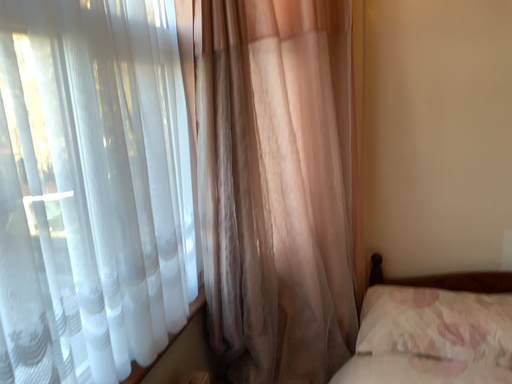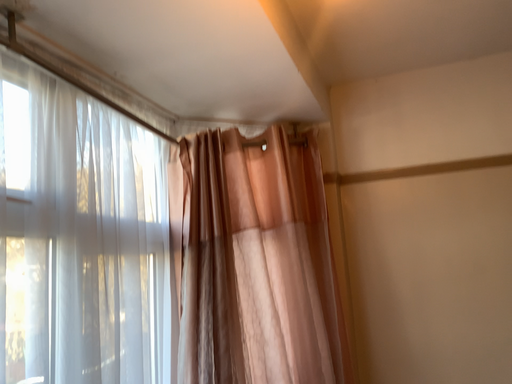
Question: How did the camera likely rotate when shooting the video?

Choices:
 (A) rotated upward
 (B) rotated downward

Answer: (A)